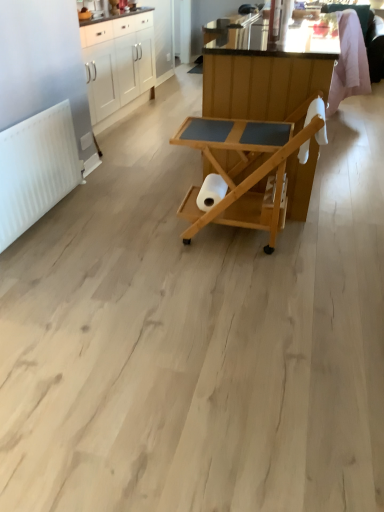
Question: Does point (266, 156) appear closer or farther from the camera than point (62, 138)?

Choices:
 (A) farther
 (B) closer

Answer: (B)

Question: From a real-world perspective, is natural wood serving cart at center, placed as the second table when sorted from back to front, physically located above or below white matte radiator at left?

Choices:
 (A) below
 (B) above

Answer: (B)

Question: Which of these objects is positioned farthest from the white glossy cabinets at upper left?

Choices:
 (A) white matte toilet paper at center
 (B) white matte radiator at left
 (C) natural wood serving cart at center, placed as the second table when sorted from back to front
 (D) natural wood serving cart at center, the second table positioned from the front

Answer: (A)

Question: Which object is positioned farthest from the natural wood serving cart at center, placed as the second table when sorted from back to front?

Choices:
 (A) white matte toilet paper at center
 (B) white glossy cabinets at upper left
 (C) white matte radiator at left
 (D) natural wood serving cart at center, the second table positioned from the front

Answer: (B)